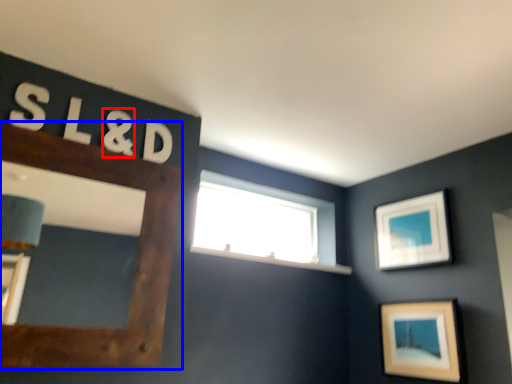
Question: Which point is closer to the camera, number (highlighted by a red box) or picture frame (highlighted by a blue box)?

Choices:
 (A) number
 (B) picture frame

Answer: (B)